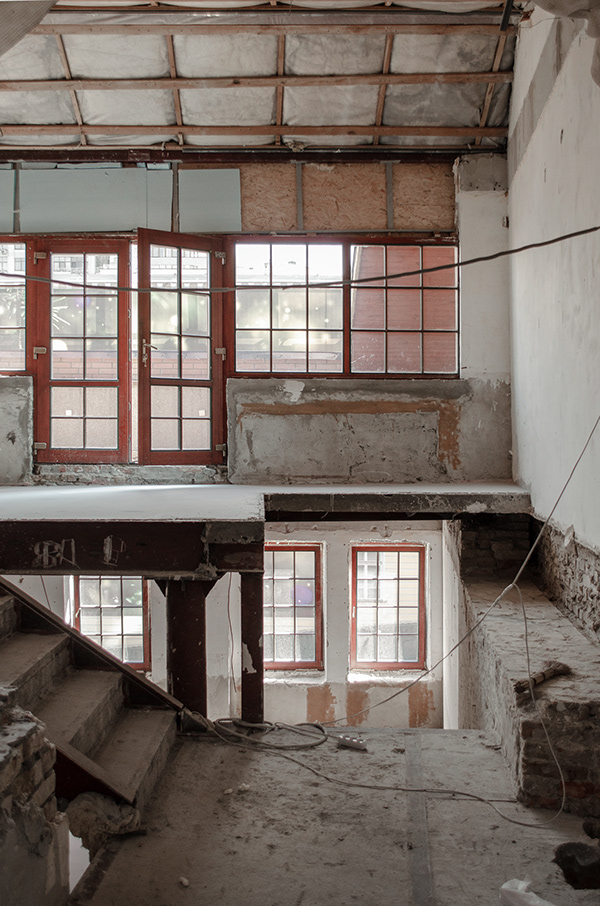
Where is `window sill`? This screenshot has height=906, width=600. window sill is located at coordinates (383, 671).